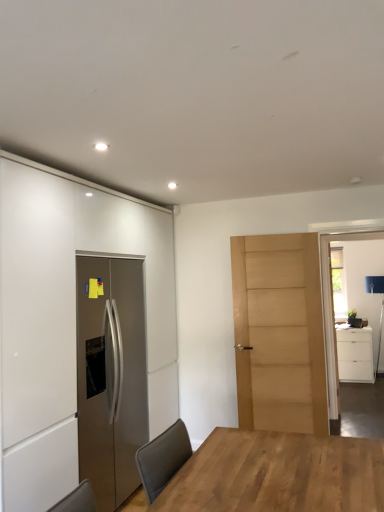
Question: From a real-world perspective, is light brown wood door at center physically located above or below clear glass door at right?

Choices:
 (A) below
 (B) above

Answer: (A)

Question: Considering the positions of point (294, 245) and point (334, 340), is point (294, 245) closer or farther from the camera than point (334, 340)?

Choices:
 (A) farther
 (B) closer

Answer: (B)

Question: Considering the real-world distances, which object is farthest from the clear glass door at right?

Choices:
 (A) light brown wood door at center
 (B) white matte cabinet at right, acting as the 2th cabinetry starting from the left
 (C) white matte cabinet at left, acting as the 1th cabinetry starting from the left
 (D) light brown wooden table at center

Answer: (B)

Question: Estimate the real-world distances between objects in this image. Which object is closer to the white matte cabinet at left, the second cabinetry viewed from the back?

Choices:
 (A) light brown wooden table at center
 (B) white matte cabinet at right, the 2th cabinetry viewed from the front
 (C) clear glass door at right
 (D) light brown wood door at center

Answer: (A)